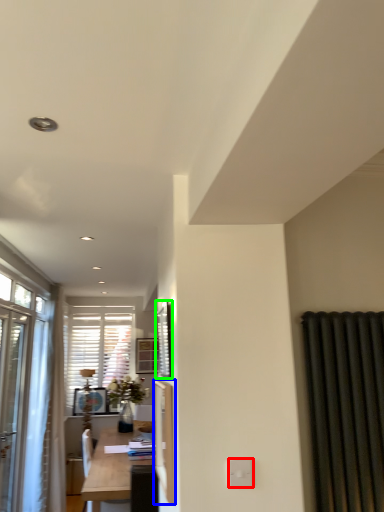
Question: Estimate the real-world distances between objects in this image. Which object is farther from electric outlet (highlighted by a red box), screen door (highlighted by a blue box) or window screen (highlighted by a green box)?

Choices:
 (A) screen door
 (B) window screen

Answer: (B)